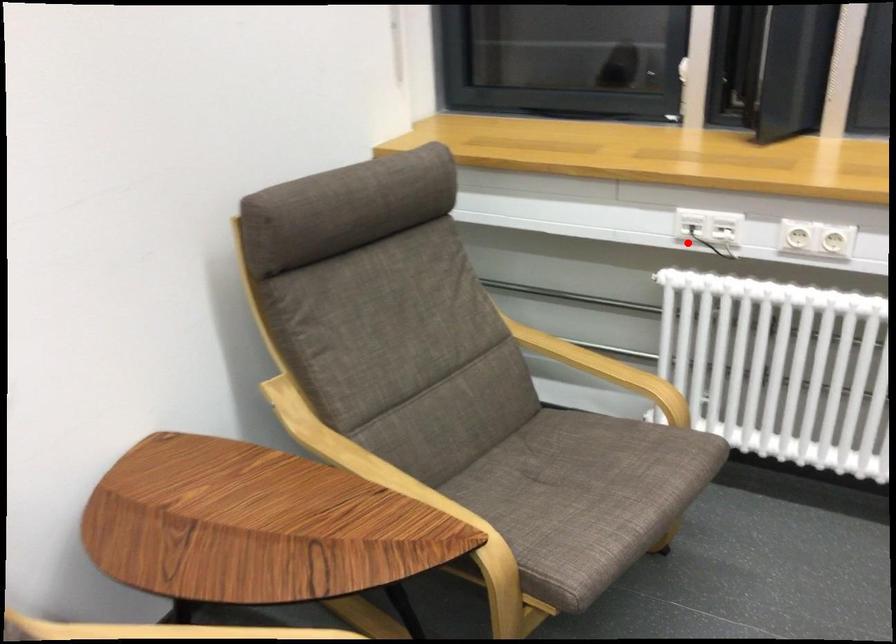
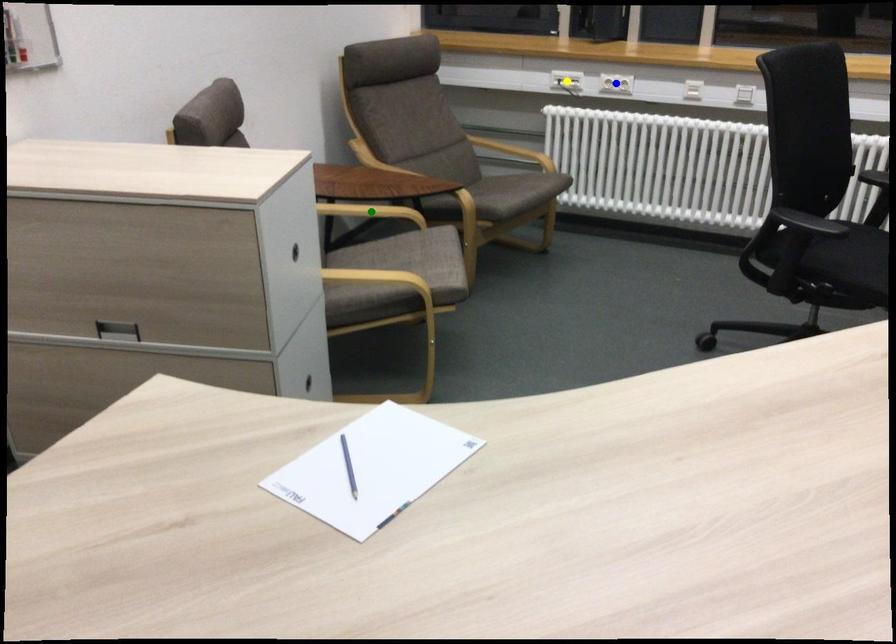
Question: I am providing you with two images of the same scene from different viewpoints. A red point is marked on the first image. You are given multiple points on the second image. Which spot in image 2 lines up with the point in image 1?

Choices:
 (A) yellow point
 (B) blue point
 (C) green point

Answer: (A)